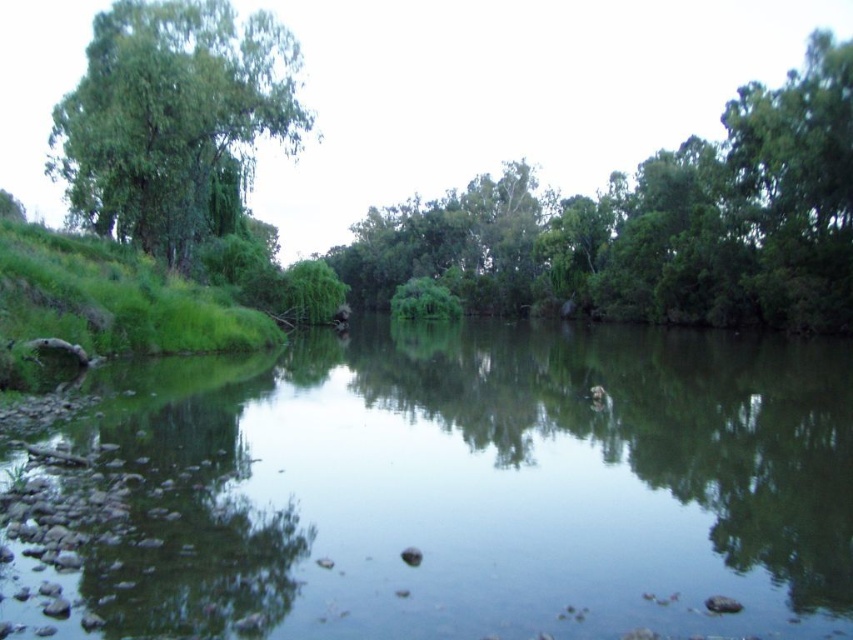
Can you confirm if green grassy river at center is smaller than green leafy tree at left?

Yes.

Is green grassy river at center behind green leafy tree at left?

No, green grassy river at center is closer to the viewer.

Image resolution: width=853 pixels, height=640 pixels. What do you see at coordinates (482, 488) in the screenshot?
I see `green grassy river at center` at bounding box center [482, 488].

I want to click on green grassy river at center, so click(482, 488).

What do you see at coordinates (482, 488) in the screenshot? This screenshot has height=640, width=853. I see `green grassy river at center` at bounding box center [482, 488].

Where is `green grassy river at center`? This screenshot has width=853, height=640. green grassy river at center is located at coordinates (482, 488).

Who is more forward, (824, 128) or (259, 33)?

Point (259, 33) is more forward.

Who is shorter, green leafy tree at center or green leafy tree at left?

green leafy tree at left is shorter.

Who is more distant from viewer, (471, 275) or (196, 189)?

Point (471, 275)

Find the location of a particular element. The width and height of the screenshot is (853, 640). green leafy tree at center is located at coordinates (654, 225).